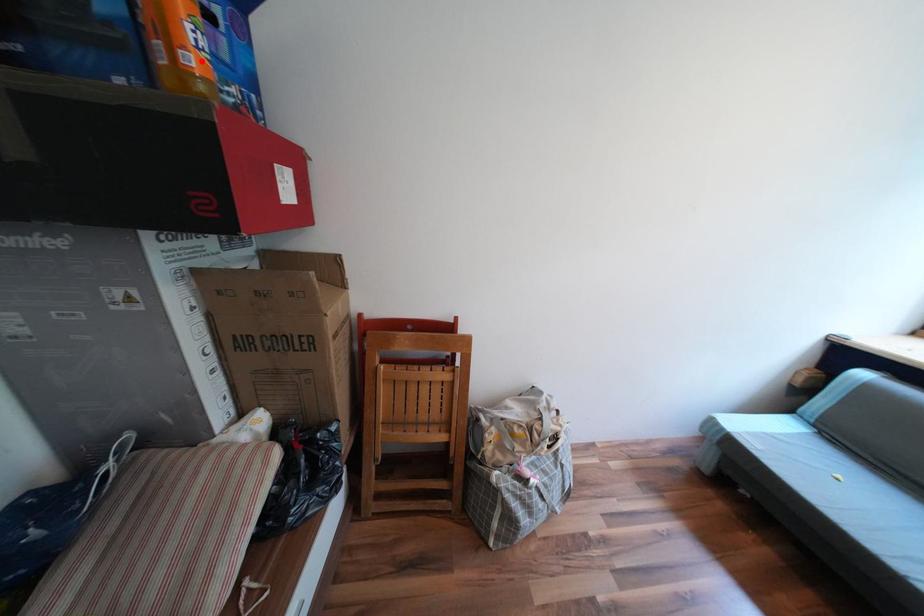
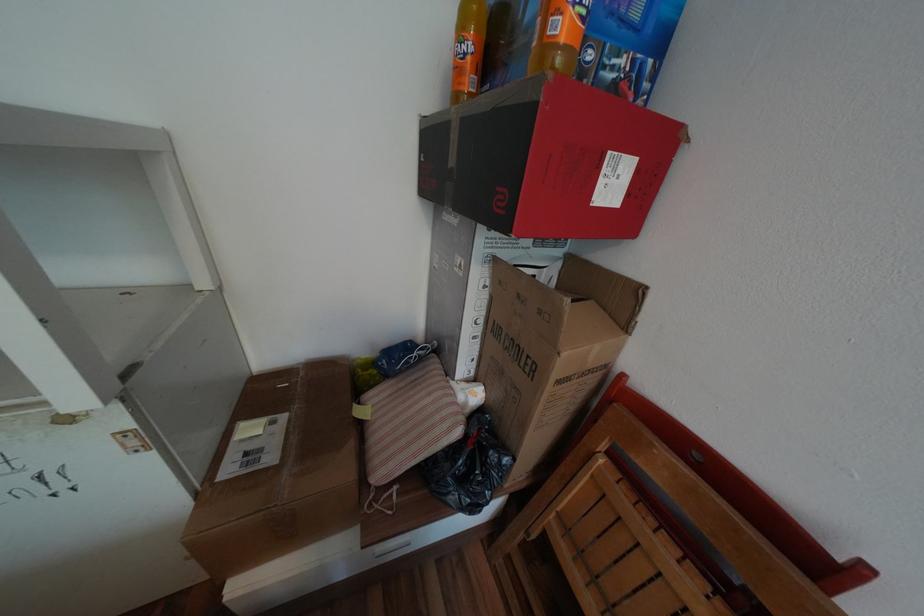
Where in the second image is the point corresponding to the highlighted location from the first image?

(569, 26)